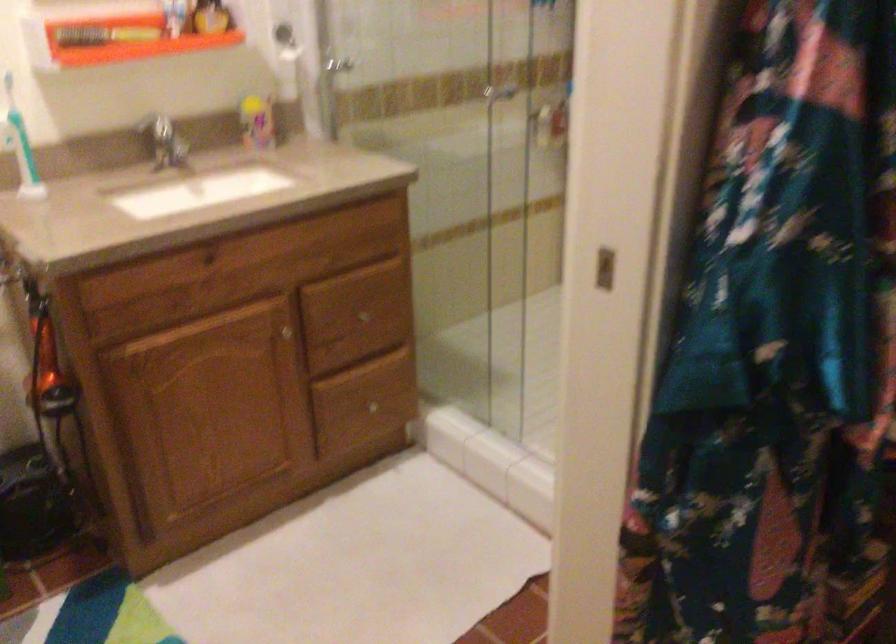
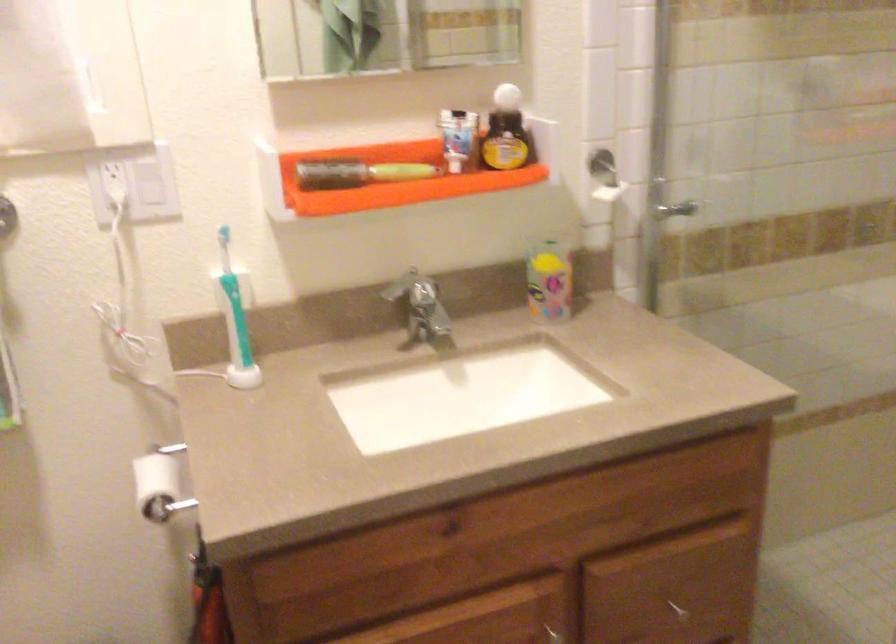
The point at (287, 341) is marked in the first image. Where is the corresponding point in the second image?

(555, 635)